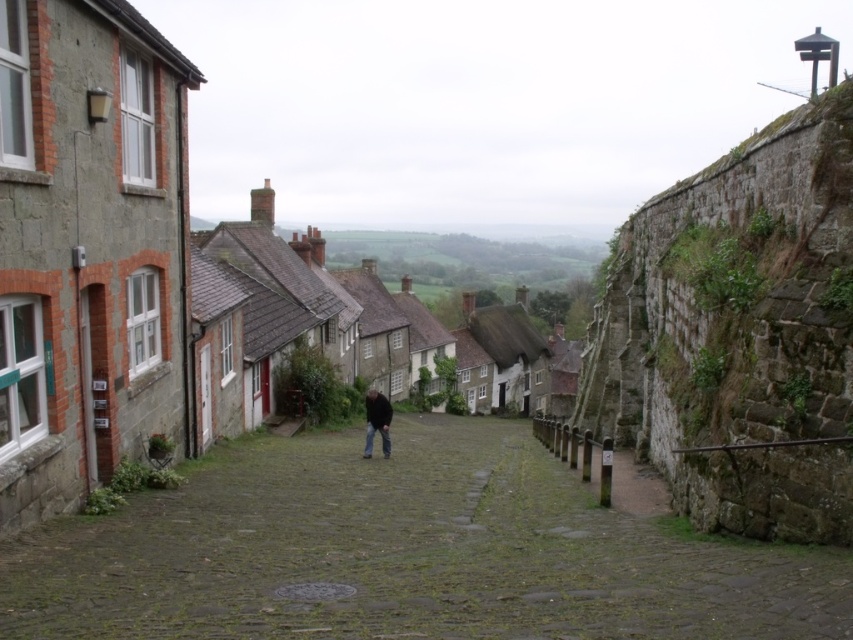
Based on the scene description, where is the stone paved alley at center located in terms of coordinates?

The stone paved alley at center is located at coordinates point (x=405, y=554).

You are standing at the entrance of a historic village and see a point marked at coordinates (405, 554). According to the image, where is this point located?

The point at (405, 554) is located at the stone paved alley at center.